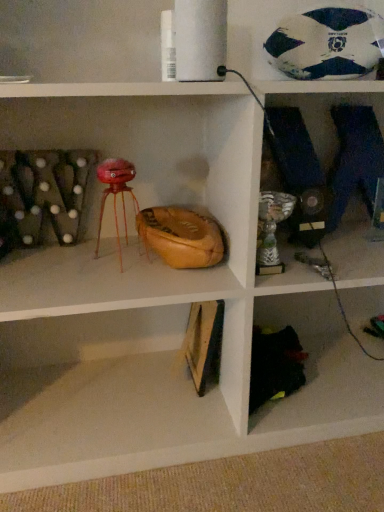
Question: Considering the positions of point (354, 64) and point (76, 385), is point (354, 64) closer or farther from the camera than point (76, 385)?

Choices:
 (A) closer
 (B) farther

Answer: (A)

Question: Is white and blue textured soccer ball at upper right bigger or smaller than wooden frame at lower center?

Choices:
 (A) big
 (B) small

Answer: (B)

Question: Looking at their shapes, would you say white and blue textured soccer ball at upper right is wider or thinner than wooden frame at lower center?

Choices:
 (A) wide
 (B) thin

Answer: (B)

Question: From the image's perspective, is wooden frame at lower center positioned above or below white and blue textured soccer ball at upper right?

Choices:
 (A) above
 (B) below

Answer: (B)

Question: Considering the positions of point (183, 454) and point (302, 31), is point (183, 454) closer or farther from the camera than point (302, 31)?

Choices:
 (A) farther
 (B) closer

Answer: (A)

Question: In terms of height, does wooden frame at lower center look taller or shorter compared to white and blue textured soccer ball at upper right?

Choices:
 (A) tall
 (B) short

Answer: (B)

Question: From a real-world perspective, is wooden frame at lower center physically located above or below white and blue textured soccer ball at upper right?

Choices:
 (A) below
 (B) above

Answer: (A)